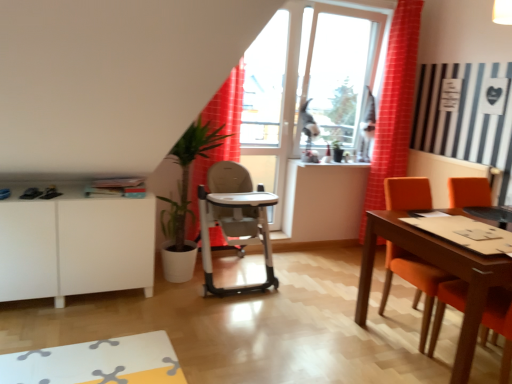
Question: Does matte orange chair at right have a lesser height compared to white matte cabinet at lower left?

Choices:
 (A) no
 (B) yes

Answer: (A)

Question: Is matte orange chair at right with white matte cabinet at lower left?

Choices:
 (A) yes
 (B) no

Answer: (B)

Question: Can you confirm if matte orange chair at right is thinner than white matte cabinet at lower left?

Choices:
 (A) yes
 (B) no

Answer: (B)

Question: Considering the relative sizes of matte orange chair at right and white matte cabinet at lower left in the image provided, is matte orange chair at right bigger than white matte cabinet at lower left?

Choices:
 (A) yes
 (B) no

Answer: (B)

Question: From the image's perspective, would you say matte orange chair at right is shown under white matte cabinet at lower left?

Choices:
 (A) no
 (B) yes

Answer: (B)

Question: Is point (212, 238) positioned closer to the camera than point (374, 147)?

Choices:
 (A) closer
 (B) farther

Answer: (A)

Question: Looking at the image, does red fabric curtain at center, which ranks as the 1th curtain in left-to-right order, seem bigger or smaller compared to red checkered curtain at right, which is the 1th curtain from right to left?

Choices:
 (A) big
 (B) small

Answer: (B)

Question: Which is correct: red fabric curtain at center, which is counted as the 2th curtain, starting from the right, is inside red checkered curtain at right, positioned as the second curtain in left-to-right order, or outside of it?

Choices:
 (A) inside
 (B) outside

Answer: (B)

Question: Is red fabric curtain at center, which ranks as the 1th curtain in left-to-right order, taller or shorter than red checkered curtain at right, which is the 1th curtain from right to left?

Choices:
 (A) short
 (B) tall

Answer: (A)

Question: Is green leafy plant at center wider or thinner than white matte cabinet at lower left?

Choices:
 (A) thin
 (B) wide

Answer: (B)

Question: Visually, is green leafy plant at center positioned to the left or to the right of white matte cabinet at lower left?

Choices:
 (A) left
 (B) right

Answer: (B)

Question: Considering the positions of green leafy plant at center and white matte cabinet at lower left in the image, is green leafy plant at center taller or shorter than white matte cabinet at lower left?

Choices:
 (A) tall
 (B) short

Answer: (A)

Question: From the image's perspective, is green leafy plant at center located above or below white matte cabinet at lower left?

Choices:
 (A) above
 (B) below

Answer: (A)

Question: Is green leafy plant at center bigger or smaller than silver metallic highchair at center?

Choices:
 (A) small
 (B) big

Answer: (A)

Question: Would you say green leafy plant at center is to the left or to the right of silver metallic highchair at center in the picture?

Choices:
 (A) right
 (B) left

Answer: (B)